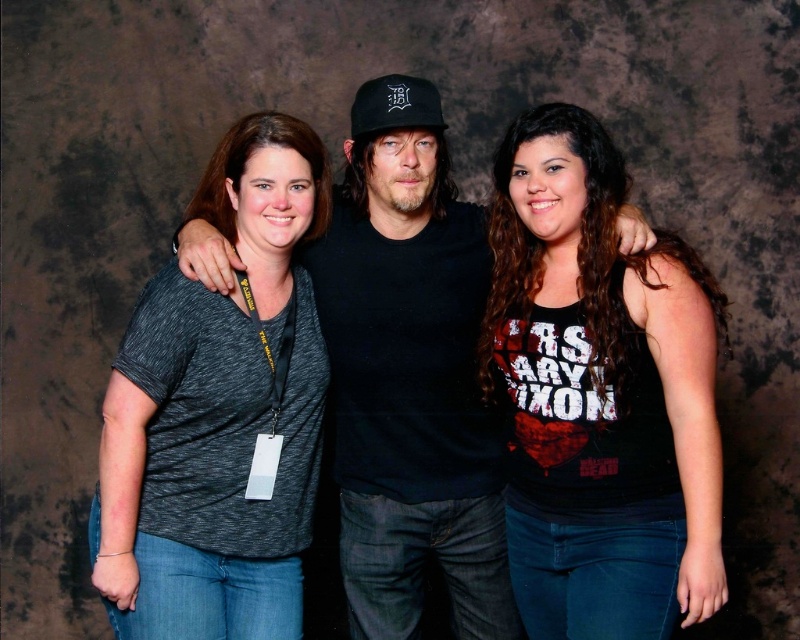
Question: Is black matte t-shirt at center positioned at the back of black matte baseball cap at center?

Choices:
 (A) no
 (B) yes

Answer: (A)

Question: Which point is closer to the camera?

Choices:
 (A) black matte baseball cap at center
 (B) black tank top at center

Answer: (B)

Question: Does black tank top at center appear on the right side of black matte t-shirt at center?

Choices:
 (A) yes
 (B) no

Answer: (A)

Question: Which point appears farthest from the camera in this image?

Choices:
 (A) (380, 616)
 (B) (584, 253)
 (C) (230, 396)

Answer: (A)

Question: Which of the following is the closest to the observer?

Choices:
 (A) (468, 627)
 (B) (264, 166)

Answer: (B)

Question: Can you confirm if dark gray heathered t-shirt at left is bigger than black matte baseball cap at center?

Choices:
 (A) yes
 (B) no

Answer: (A)